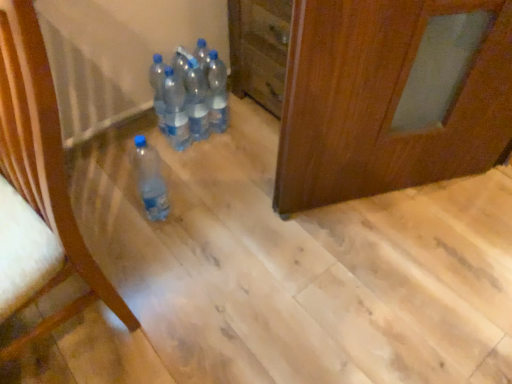
I want to click on free location to the right of clear plastic bottle at left, so click(195, 301).